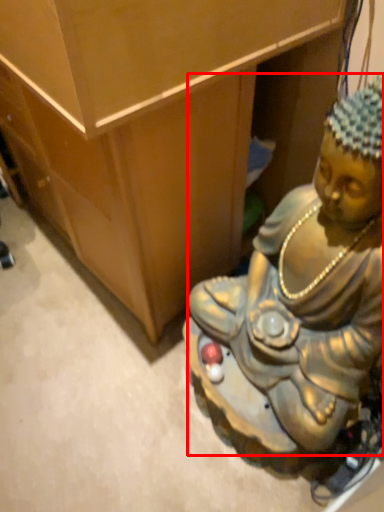
Question: From the image's perspective, considering the relative positions of person (annotated by the red box) and furniture in the image provided, where is person (annotated by the red box) located with respect to the staircase?

Choices:
 (A) below
 (B) above

Answer: (A)